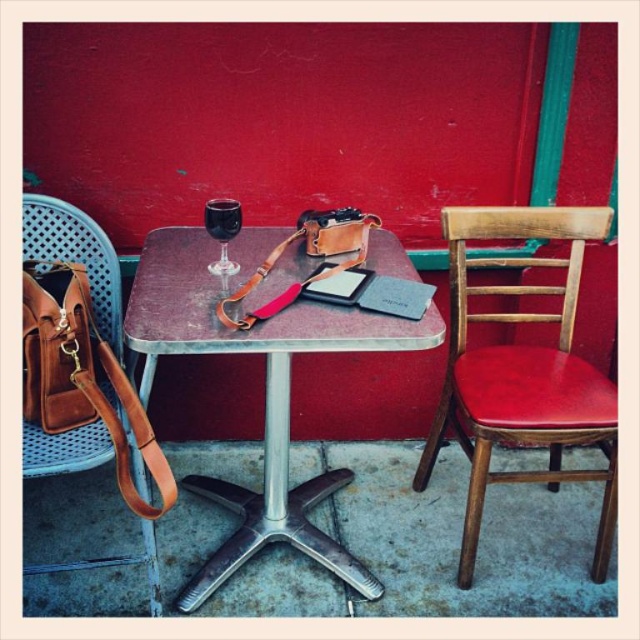
Does rustic wood table at center have a greater height compared to wooden chair with red cushion at right?

No.

Which of these two, rustic wood table at center or wooden chair with red cushion at right, stands shorter?

rustic wood table at center is shorter.

Find the location of a particular element. rustic wood table at center is located at coordinates (264, 387).

Is point (404, 346) farther from camera compared to point (321, 225)?

No, it is not.

Is rustic wood table at center smaller than brown leather strap at table?

No.

Locate an element on the screen. rustic wood table at center is located at coordinates (264, 387).

Between point (452, 344) and point (324, 228), which one is positioned behind?

Positioned behind is point (452, 344).

Locate an element on the screen. Image resolution: width=640 pixels, height=640 pixels. wooden chair with red cushion at right is located at coordinates (522, 371).